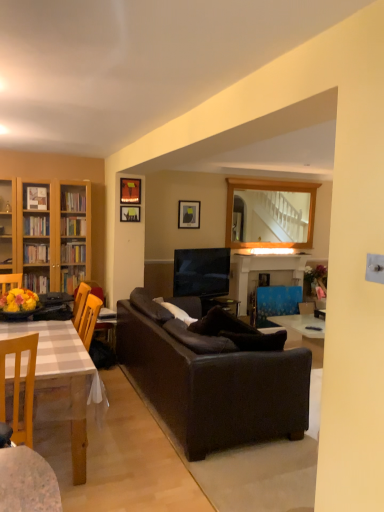
Question: Is white checkered table at left wider or thinner than wooden chair at lower left?

Choices:
 (A) thin
 (B) wide

Answer: (B)

Question: From the image's perspective, is white checkered table at left located above or below wooden chair at lower left?

Choices:
 (A) below
 (B) above

Answer: (A)

Question: Considering the real-world distances, which object is farthest from the wooden mirror at upper center?

Choices:
 (A) blue painted wood fireplace at center
 (B) leather couch at center
 (C) white checkered table at left
 (D) wooden chair at lower left
 (E) matte black picture frame at upper center, which ranks as the 1th picture frame in front-to-back order

Answer: (D)

Question: Which is nearer to the wooden mirror at upper center?

Choices:
 (A) matte black picture frame at upper center, positioned as the third picture frame in right-to-left order
 (B) matte black picture frame at upper center, which is the 3th picture frame from front to back
 (C) wooden chair at lower left
 (D) white checkered table at left
 (E) matte black picture frame at upper center, the 3th picture frame when ordered from back to front

Answer: (B)